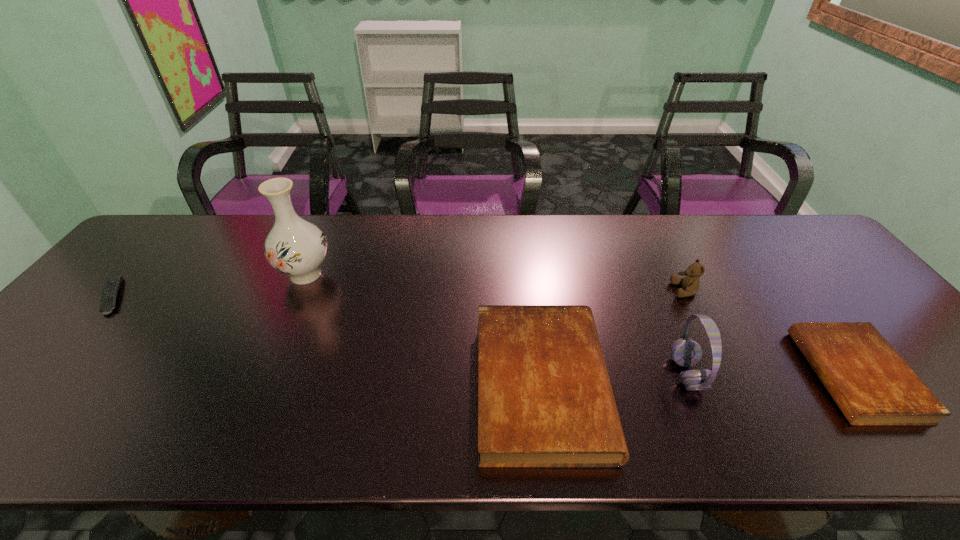
This screenshot has height=540, width=960. Identify the location of the fourth tallest object. (545, 400).

At what (x,y) coordinates should I click in order to perform the action: click on the third object from left to right. Please return your answer as a coordinate pair (x, y). Looking at the image, I should click on (545, 400).

Identify the location of the fifth tallest object. (872, 385).

Find the location of a particular element. The height and width of the screenshot is (540, 960). the rightmost object is located at coordinates (872, 385).

Locate an element on the screen. the tallest object is located at coordinates (295, 247).

What are the coordinates of `the fifth object from right to left` in the screenshot? It's located at (295, 247).

At what (x,y) coordinates should I click in order to perform the action: click on remote control. Please return your answer as a coordinate pair (x, y). Looking at the image, I should click on (112, 285).

I want to click on the shortest object, so [112, 285].

What are the coordinates of `the second object from right to left` in the screenshot? It's located at (690, 284).

Find the location of `the fourth shortest object`. the fourth shortest object is located at coordinates (690, 284).